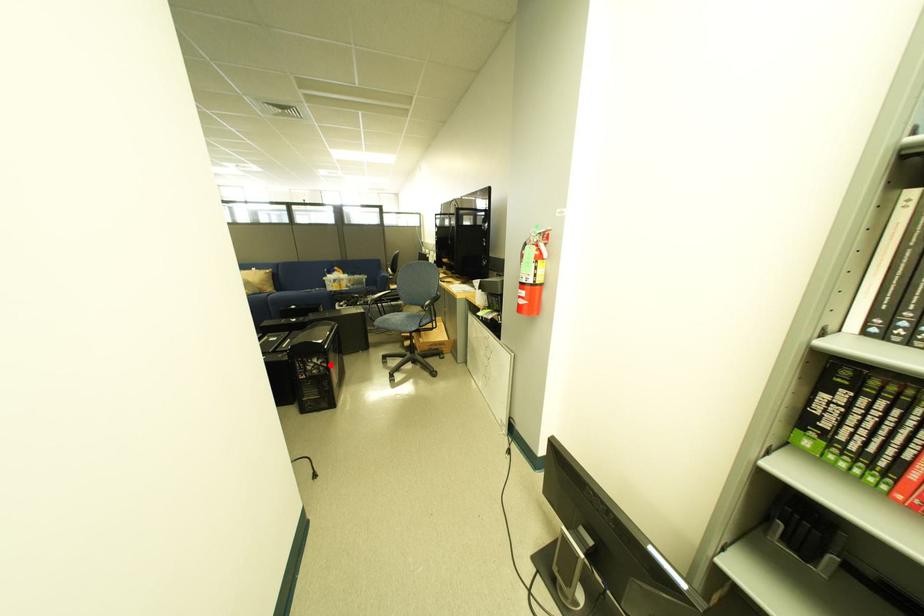
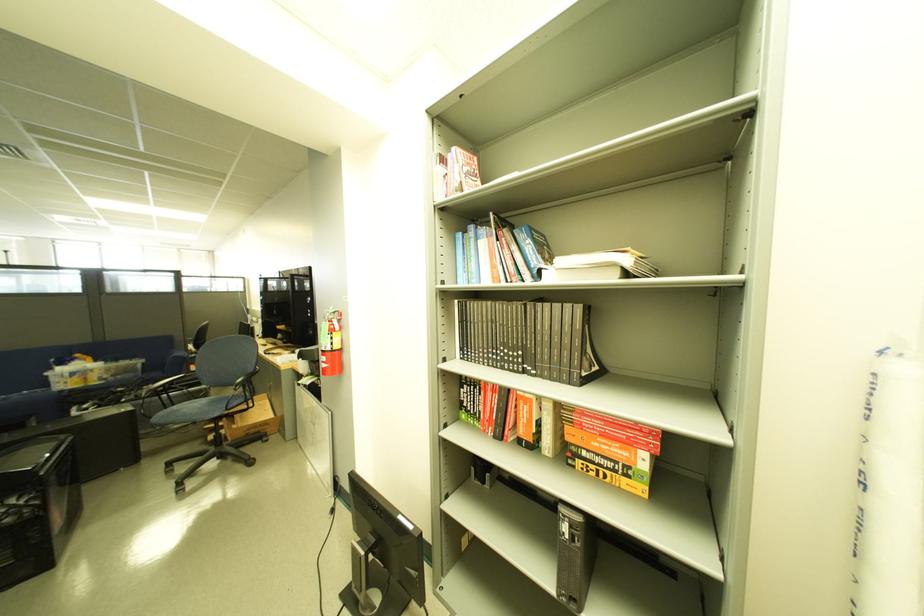
Question: I am providing you with two images of the same scene from different viewpoints. Given a red point in image1, look at the same physical point in image2. Is it:

Choices:
 (A) Closer to the viewpoint
 (B) Farther from the viewpoint

Answer: (B)